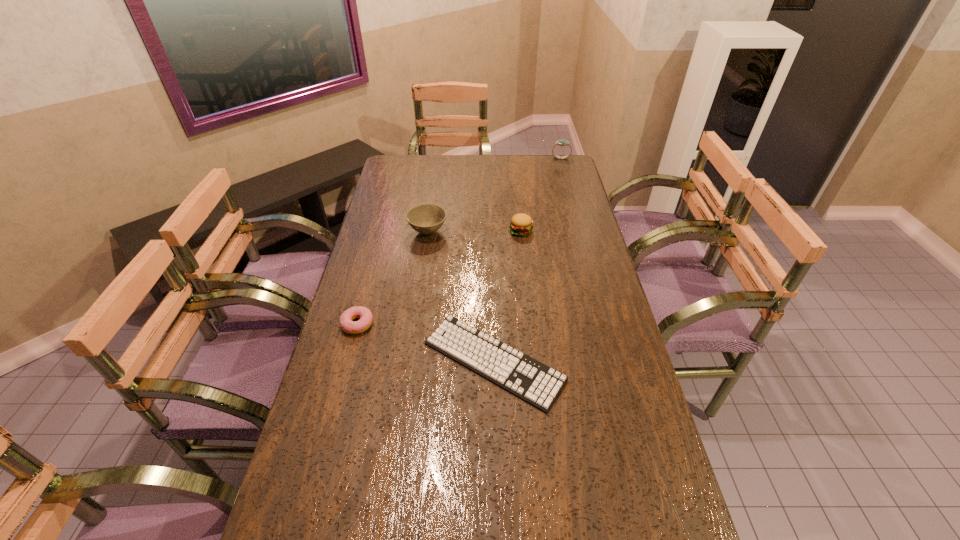
Where is `watch`? The image size is (960, 540). watch is located at coordinates click(x=561, y=142).

This screenshot has height=540, width=960. In order to click on the rightmost object in this screenshot , I will do `click(561, 142)`.

The height and width of the screenshot is (540, 960). What are the coordinates of `bowl` in the screenshot? It's located at (427, 218).

Where is `hamburger`? The width and height of the screenshot is (960, 540). hamburger is located at coordinates (521, 224).

The image size is (960, 540). What are the coordinates of `the leftmost object` in the screenshot? It's located at (366, 318).

I want to click on doughnut, so click(x=366, y=318).

The image size is (960, 540). Identify the location of computer keyboard. (539, 385).

Locate an element on the screen. The width and height of the screenshot is (960, 540). vacant area situated on the left of the farthest object is located at coordinates (491, 158).

Where is `free spot located on the left of the bowl`? Image resolution: width=960 pixels, height=540 pixels. free spot located on the left of the bowl is located at coordinates click(x=387, y=232).

Identify the location of blank space located on the back of the hamburger. This screenshot has width=960, height=540. (515, 178).